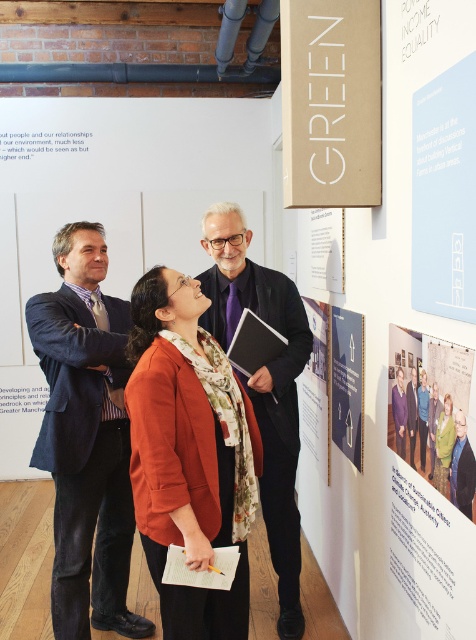
Question: Which point appears closest to the camera in this image?

Choices:
 (A) (296, 579)
 (B) (181, 420)

Answer: (B)

Question: Does matte paper poster at center appear on the left side of matte black poster at center?

Choices:
 (A) no
 (B) yes

Answer: (A)

Question: Which object is the farthest from the purple floral shirt at center?

Choices:
 (A) light blue paper at upper right
 (B) matte paper poster at center
 (C) dark blue suit at center
 (D) orange matte blazer at center

Answer: (A)

Question: Does dark blue suit at center come behind matte black poster at center?

Choices:
 (A) yes
 (B) no

Answer: (B)

Question: Is orange matte blazer at center thinner than matte paper poster at center?

Choices:
 (A) yes
 (B) no

Answer: (B)

Question: Based on their relative distances, which object is farther from the matte black poster at center?

Choices:
 (A) matte paper poster at center
 (B) purple floral shirt at center

Answer: (A)